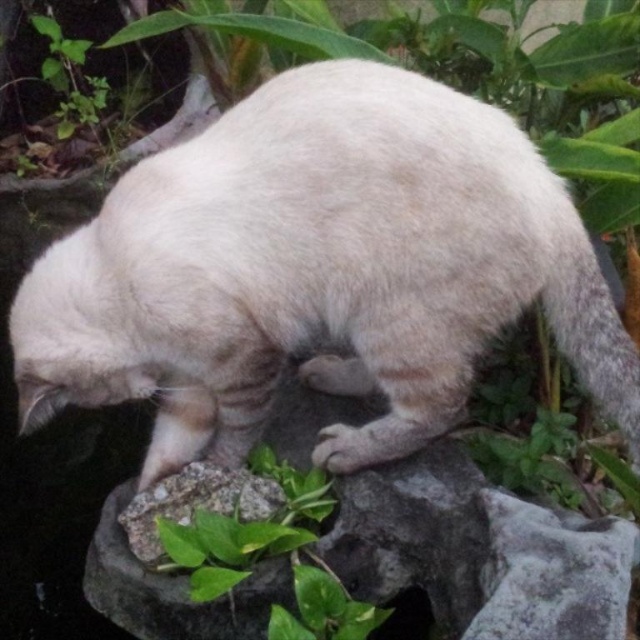
Which is in front, point (35, 416) or point (196, 602)?

Point (196, 602)

Can you confirm if white fur cat at center is positioned above green leafy plant at center?

Yes.

I want to click on white fur cat at center, so click(317, 272).